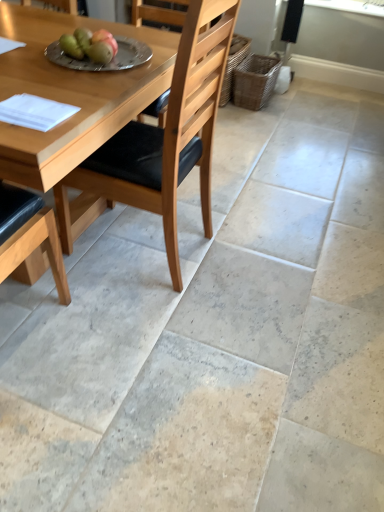
Identify the location of vacant area in front of green matte apple at upper left, the 1th fruit from the left. The width and height of the screenshot is (384, 512). (55, 72).